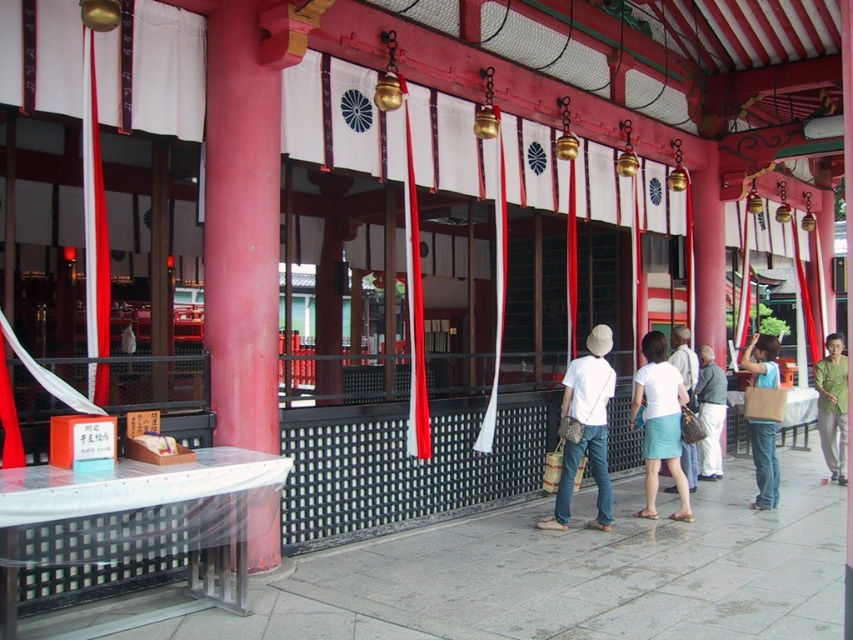
Between point (566, 481) and point (840, 396), which one is positioned in front?

Point (566, 481)

Is point (576, 454) positioned in front of point (831, 378)?

Yes, it is.

Where is `white woven basket at center`? Image resolution: width=853 pixels, height=640 pixels. white woven basket at center is located at coordinates (585, 429).

Which is in front, point (772, 342) or point (714, 371)?

Positioned in front is point (772, 342).

Who is positioned more to the left, denim jeans at center or light blue denim jeans at center?

From the viewer's perspective, light blue denim jeans at center appears more on the left side.

Who is more distant from viewer, (753, 365) or (715, 474)?

Positioned behind is point (715, 474).

Locate an element on the screen. This screenshot has height=640, width=853. denim jeans at center is located at coordinates (764, 461).

Which is more to the right, green cotton shirt at right or denim shorts at center?

green cotton shirt at right

Who is taller, green cotton shirt at right or denim shorts at center?

Standing taller between the two is green cotton shirt at right.

Does point (821, 445) lie behind point (688, 380)?

Yes, it is.

At what (x,y) coordinates should I click in order to perform the action: click on green cotton shirt at right. Please return your answer as a coordinate pair (x, y). Looking at the image, I should click on tap(833, 404).